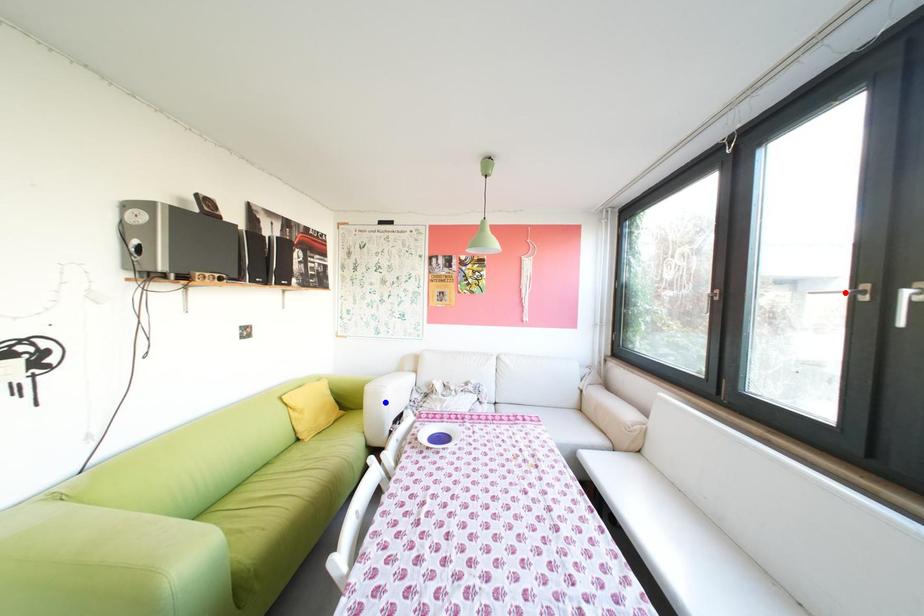
Question: In the image, two points are highlighted. Which point is nearer to the camera? Reply with the corresponding letter.

Choices:
 (A) blue point
 (B) red point

Answer: (B)